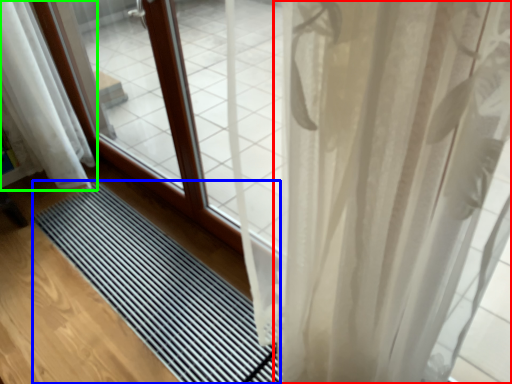
Question: Estimate the real-world distances between objects in this image. Which object is farther from curtain (highlighted by a red box), mat (highlighted by a blue box) or curtain (highlighted by a green box)?

Choices:
 (A) mat
 (B) curtain

Answer: (B)